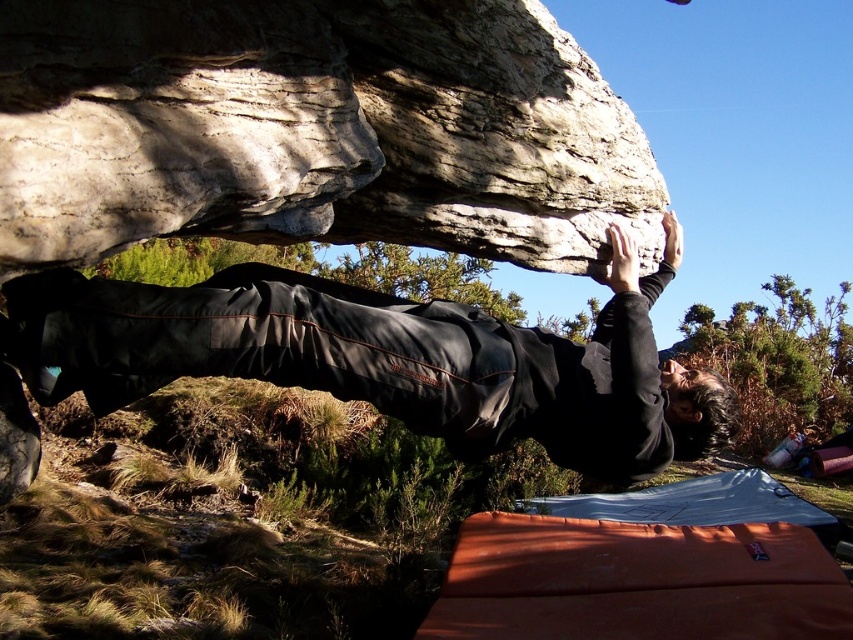
Question: In this image, where is rough textured rock at upper center located relative to black matte pants at center?

Choices:
 (A) above
 (B) below

Answer: (A)

Question: Can you confirm if rough textured rock at upper center is positioned to the right of black matte pants at center?

Choices:
 (A) yes
 (B) no

Answer: (B)

Question: Which point is closer to the camera?

Choices:
 (A) black matte pants at center
 (B) rough textured rock at upper center

Answer: (B)

Question: Is rough textured rock at upper center wider than black matte pants at center?

Choices:
 (A) yes
 (B) no

Answer: (B)

Question: Which object appears farthest from the camera in this image?

Choices:
 (A) black matte pants at center
 (B) rough textured rock at upper center

Answer: (A)